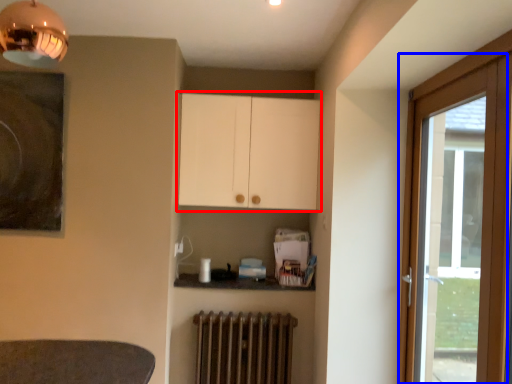
Question: Which object is closer to the camera taking this photo, cabinetry (highlighted by a red box) or door (highlighted by a blue box)?

Choices:
 (A) cabinetry
 (B) door

Answer: (B)